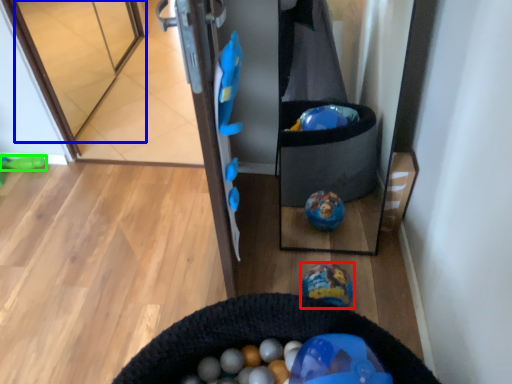
Question: Based on their relative distances, which object is nearer to toy (highlighted by a red box)? Choose from glass door (highlighted by a blue box) and toy (highlighted by a green box).

Choices:
 (A) glass door
 (B) toy

Answer: (B)